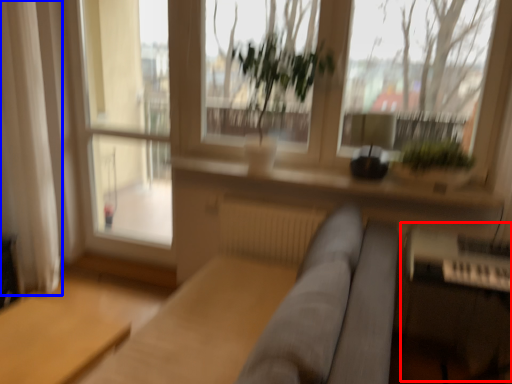
Question: Which point is closer to the camera, piano (highlighted by a red box) or curtain (highlighted by a blue box)?

Choices:
 (A) piano
 (B) curtain

Answer: (A)